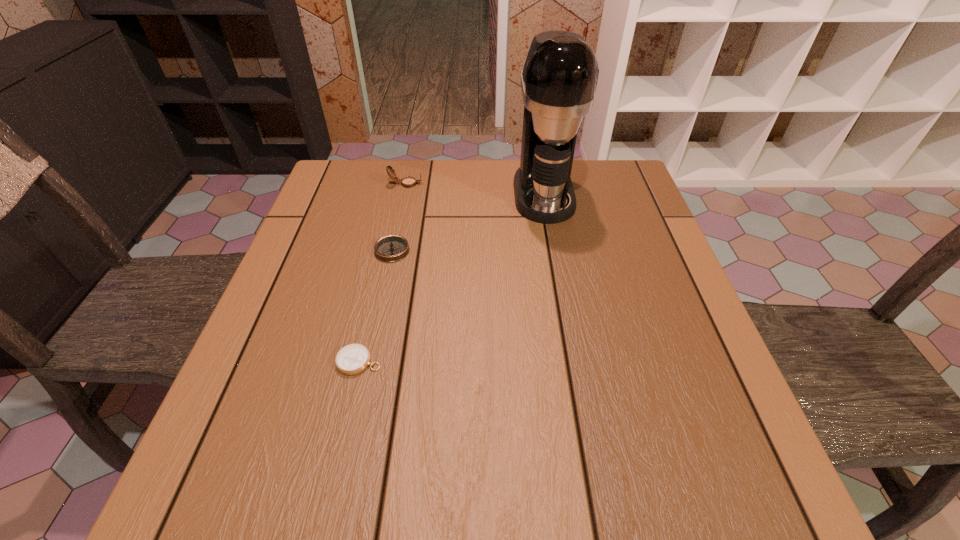
Find the location of a particular element. This screenshot has height=540, width=960. unoccupied area between the second nearest compass and the rightmost object is located at coordinates (468, 222).

Find the location of `vacant area that lies between the third shortest object and the coffee maker`. vacant area that lies between the third shortest object and the coffee maker is located at coordinates (475, 189).

Locate an element on the screen. The width and height of the screenshot is (960, 540). vacant area that lies between the second farthest compass and the tallest object is located at coordinates (468, 222).

The width and height of the screenshot is (960, 540). I want to click on free spot between the tallest object and the nearest compass, so click(x=451, y=278).

At what (x,y) coordinates should I click in order to perform the action: click on free space between the coffee maker and the second nearest object. Please return your answer as a coordinate pair (x, y). Looking at the image, I should click on (468, 222).

Locate an element on the screen. Image resolution: width=960 pixels, height=540 pixels. vacant space that is in between the second farthest compass and the nearest compass is located at coordinates (375, 306).

Where is `unoccupied position between the third farthest object and the rightmost object`? This screenshot has height=540, width=960. unoccupied position between the third farthest object and the rightmost object is located at coordinates (468, 222).

Select which object appears as the second closest to the tallest compass. Please provide its 2D coordinates. Your answer should be formatted as a tuple, i.e. [(x, y)], where the tuple contains the x and y coordinates of a point satisfying the conditions above.

[(559, 78)]

Select which object is the second closest to the second nearest object. Please provide its 2D coordinates. Your answer should be formatted as a tuple, i.e. [(x, y)], where the tuple contains the x and y coordinates of a point satisfying the conditions above.

[(352, 359)]

Identify the location of compass that stands as the closest to the rightmost object. This screenshot has width=960, height=540. (408, 182).